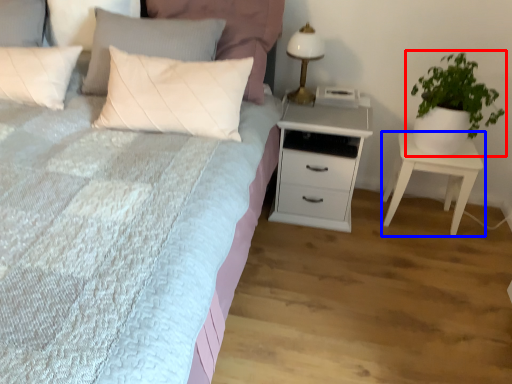
Question: Which object is further to the camera taking this photo, houseplant (highlighted by a red box) or nightstand (highlighted by a blue box)?

Choices:
 (A) houseplant
 (B) nightstand

Answer: (B)